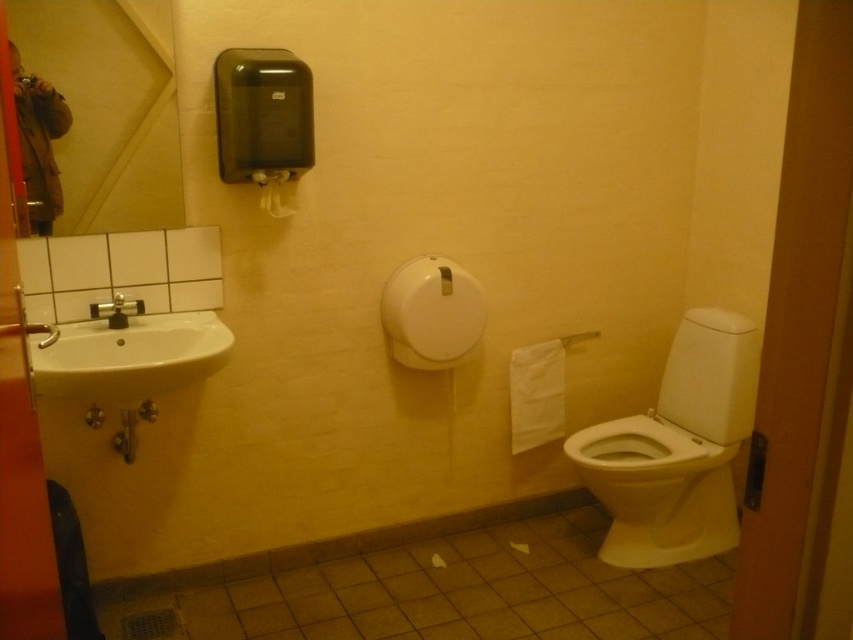
Can you confirm if white glossy toilet at lower right is bigger than matte silver faucet at left?

Yes, white glossy toilet at lower right is bigger than matte silver faucet at left.

Measure the distance between white glossy toilet at lower right and camera.

white glossy toilet at lower right and camera are 2.44 meters apart from each other.

Locate an element on the screen. The height and width of the screenshot is (640, 853). white glossy toilet at lower right is located at coordinates (676, 449).

Looking at this image, does white glossy toilet at lower right have a lesser height compared to white matte toilet paper at upper center?

Incorrect, white glossy toilet at lower right's height does not fall short of white matte toilet paper at upper center's.

Is white glossy toilet at lower right wider than white matte toilet paper at upper center?

Indeed, white glossy toilet at lower right has a greater width compared to white matte toilet paper at upper center.

Which is in front, point (709, 476) or point (282, 205)?

Positioned in front is point (282, 205).

Identify the location of white glossy toilet at lower right. (676, 449).

Is white glossy toilet at lower right bigger than white ceramic sink at left?

Indeed, white glossy toilet at lower right has a larger size compared to white ceramic sink at left.

Is white glossy toilet at lower right above white ceramic sink at left?

No.

Locate an element on the screen. The image size is (853, 640). white glossy toilet at lower right is located at coordinates (676, 449).